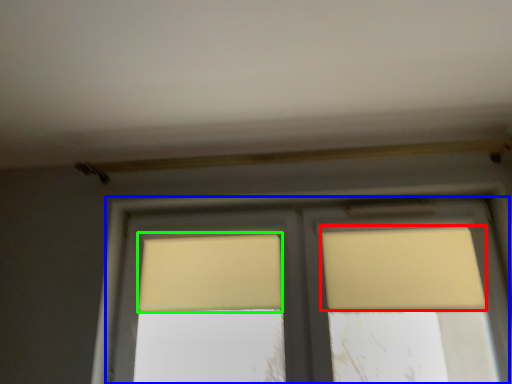
Question: Which object is the farthest from curtain (highlighted by a red box)? Choose among these: window (highlighted by a blue box) or curtain (highlighted by a green box).

Choices:
 (A) window
 (B) curtain

Answer: (B)